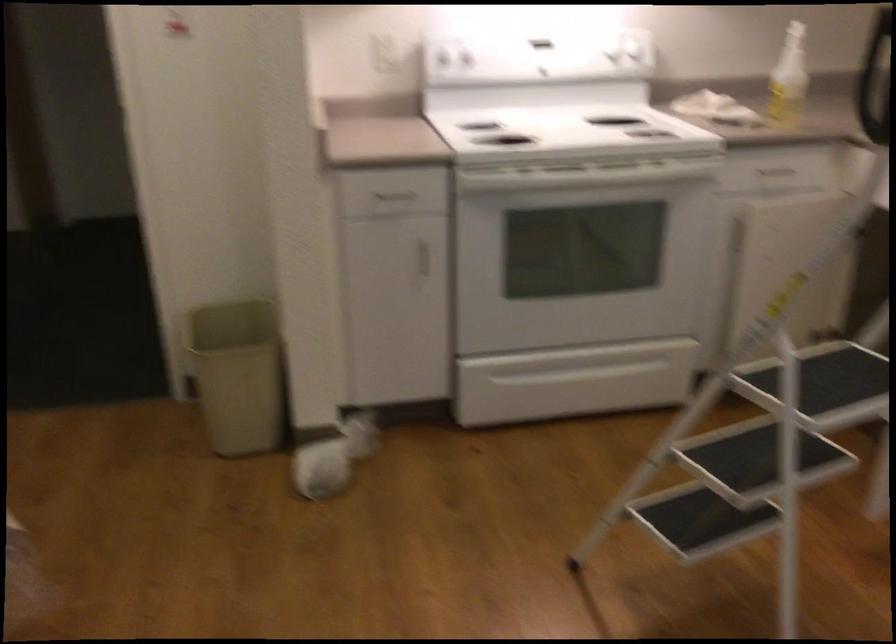
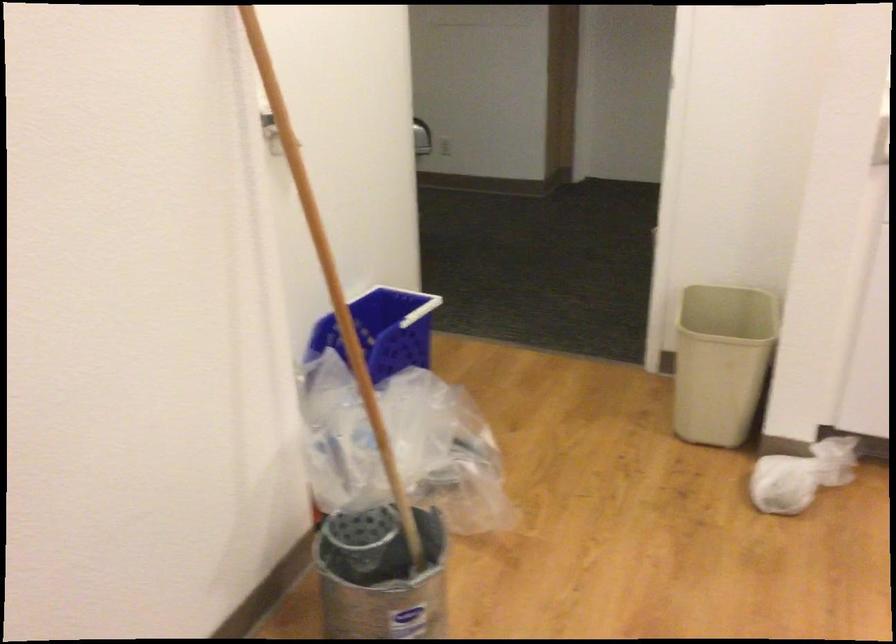
Find the pixel in the second image that matches [240,377] in the first image.

(721, 362)